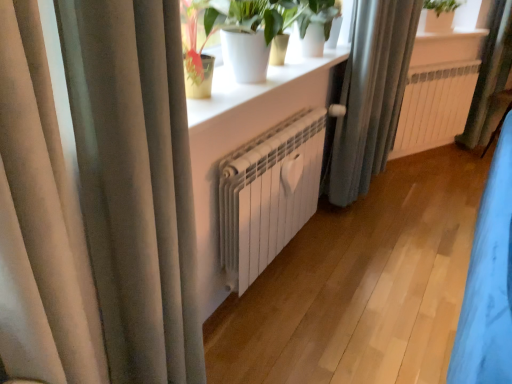
Where is `vacant space in white matte radiator at center, marked as the first radiator in a left-to-right arrangement (from a real-world perspective)`? vacant space in white matte radiator at center, marked as the first radiator in a left-to-right arrangement (from a real-world perspective) is located at coordinates (272, 281).